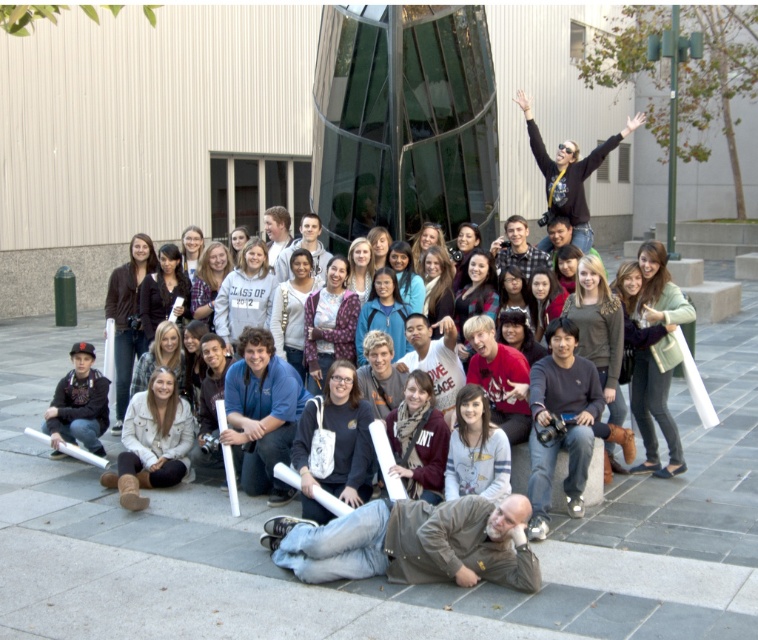
Question: Does brown leather jacket at lower center have a lesser width compared to matte black jacket at center?

Choices:
 (A) yes
 (B) no

Answer: (B)

Question: Is brown leather jacket at lower center below matte black jacket at center?

Choices:
 (A) no
 (B) yes

Answer: (B)

Question: Which of the following is the farthest from the observer?

Choices:
 (A) matte black jacket at center
 (B) brown leather jacket at lower center

Answer: (A)

Question: Which point appears closest to the camera in this image?

Choices:
 (A) (343, 524)
 (B) (138, 344)

Answer: (A)

Question: Can you confirm if brown leather jacket at lower center is wider than matte black jacket at center?

Choices:
 (A) yes
 (B) no

Answer: (A)

Question: Which object appears closest to the camera in this image?

Choices:
 (A) brown leather jacket at lower center
 (B) matte black jacket at center

Answer: (A)